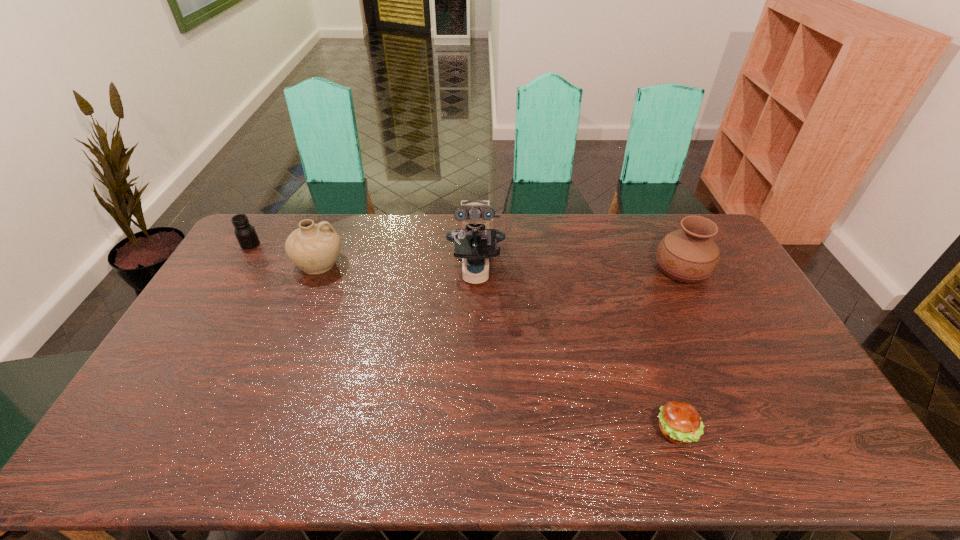
In order to click on blank area in the image that satisfies the following two spatial constraints: 1. through the eyepieces of the third object from left to right; 2. on the right side of the nearest object in this screenshot , I will do `click(474, 430)`.

Where is `vacant space that satisfies the following two spatial constraints: 1. on the front side of the hamburger; 2. on the right side of the pottery`? vacant space that satisfies the following two spatial constraints: 1. on the front side of the hamburger; 2. on the right side of the pottery is located at coordinates (252, 430).

This screenshot has height=540, width=960. What are the coordinates of `free space that satisfies the following two spatial constraints: 1. on the front side of the rightmost object; 2. on the left side of the pottery` in the screenshot? It's located at [x=317, y=268].

I want to click on vacant space that satisfies the following two spatial constraints: 1. through the eyepieces of the hamburger; 2. on the left side of the microscope, so click(x=474, y=430).